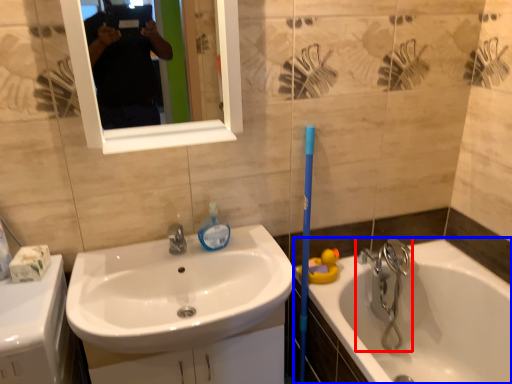
Question: Which of the following is the closest to the observer, tap (highlighted by a red box) or bathtub (highlighted by a blue box)?

Choices:
 (A) tap
 (B) bathtub

Answer: (B)